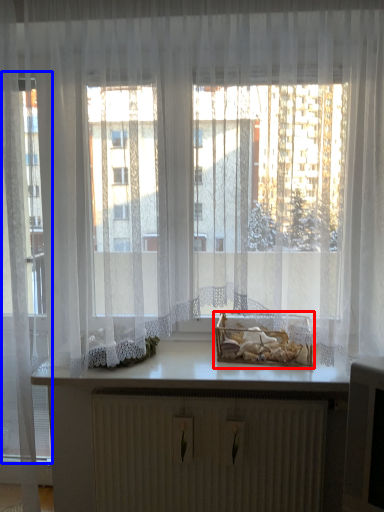
Question: Which point is further to the camera, window box (highlighted by a red box) or glass door (highlighted by a blue box)?

Choices:
 (A) window box
 (B) glass door

Answer: (A)